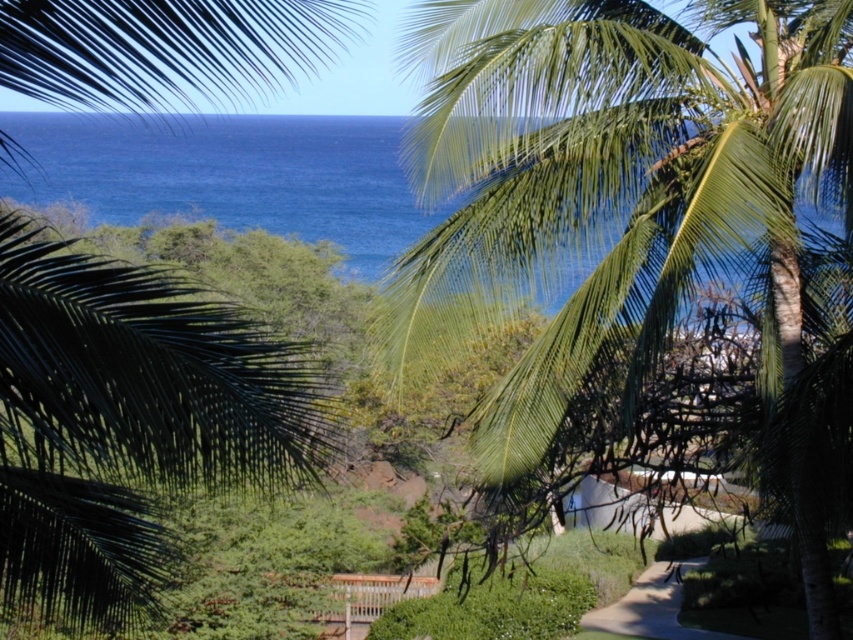
Between point (421, 310) and point (68, 493), which one is positioned behind?

Positioned behind is point (421, 310).

Is green leafy palm tree at upper right shorter than green leafy palm tree at upper left?

Yes, green leafy palm tree at upper right is shorter than green leafy palm tree at upper left.

Find the location of a particular element. The image size is (853, 640). green leafy palm tree at upper right is located at coordinates (642, 237).